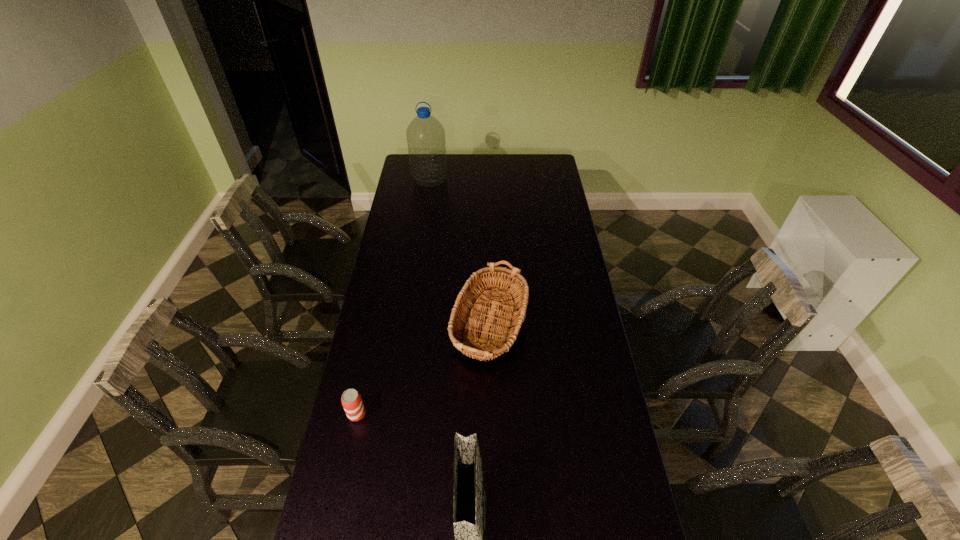
Find the location of `the farthest object`. the farthest object is located at coordinates (425, 134).

The image size is (960, 540). I want to click on the tallest object, so click(x=425, y=134).

Locate an element on the screen. The image size is (960, 540). the second shortest object is located at coordinates (466, 304).

At what (x,y) coordinates should I click in order to perform the action: click on basket. Please return your answer as a coordinate pair (x, y). The width and height of the screenshot is (960, 540). Looking at the image, I should click on (466, 304).

Find the location of a particular element. The width and height of the screenshot is (960, 540). the third farthest object is located at coordinates (351, 399).

The height and width of the screenshot is (540, 960). In order to click on the shortest object in this screenshot , I will do `click(351, 399)`.

Identify the location of vacant area located 0.160m on the right of the water jug. This screenshot has height=540, width=960. (476, 179).

Identify the location of free space located 0.160m on the left of the basket. 389,332.

This screenshot has width=960, height=540. In order to click on free space located 0.350m on the back of the third farthest object in this screenshot , I will do `click(375, 325)`.

This screenshot has height=540, width=960. Identify the location of object at the far edge. (425, 134).